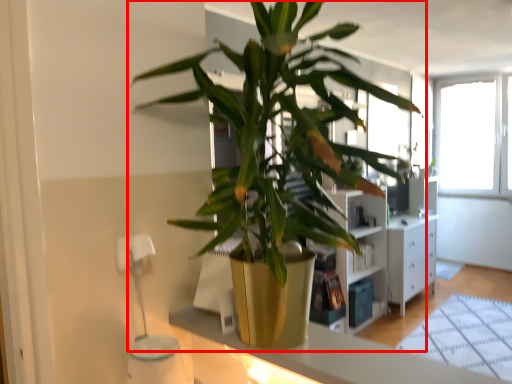
Question: Where is houseplant (annotated by the red box) located in relation to counter top in the image?

Choices:
 (A) right
 (B) left

Answer: (A)